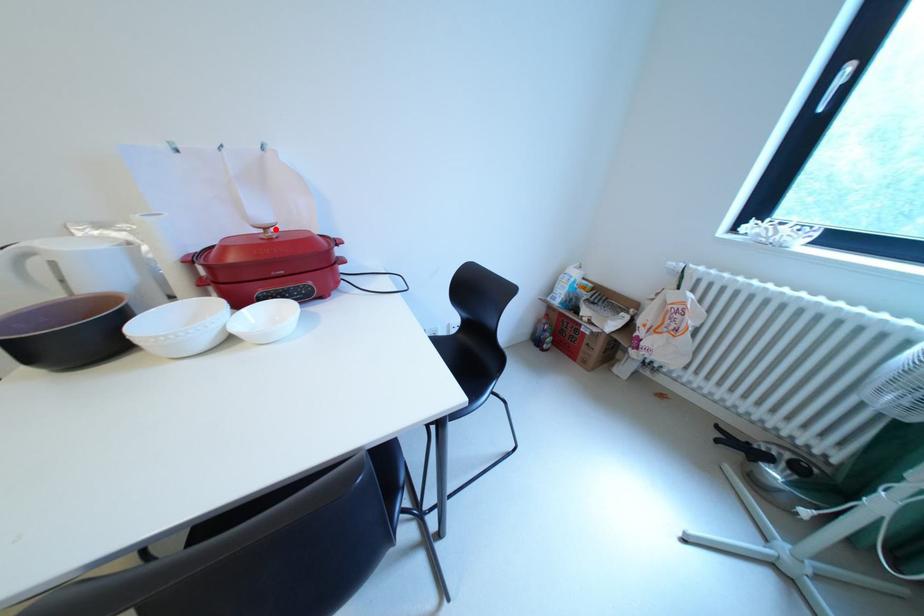
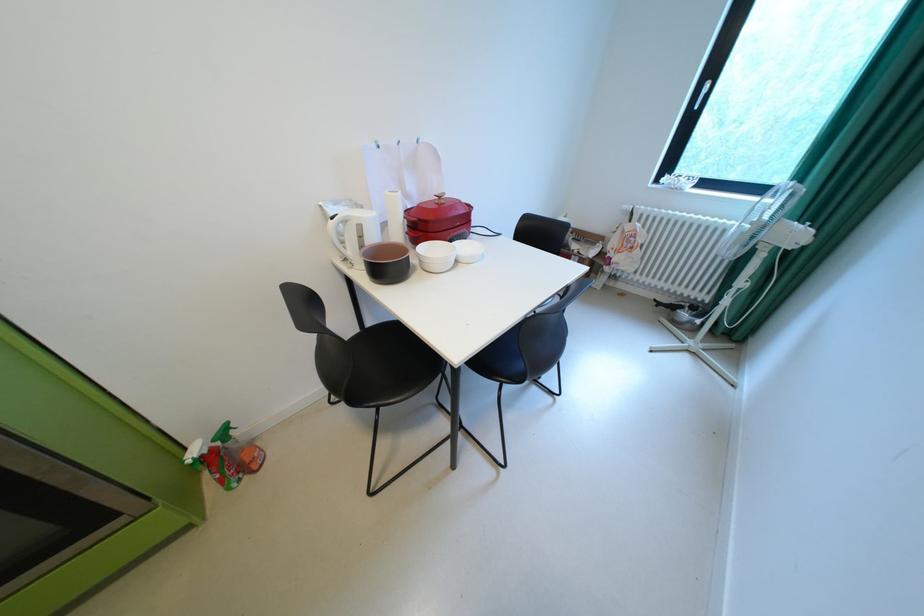
In the second image, find the point that corresponds to the highlighted location in the first image.

(450, 198)